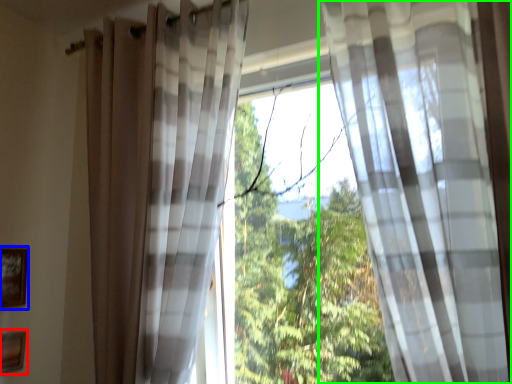
Question: Estimate the real-world distances between objects in this image. Which object is closer to picture frame (highlighted by a red box), picture frame (highlighted by a blue box) or curtain (highlighted by a green box)?

Choices:
 (A) picture frame
 (B) curtain

Answer: (A)